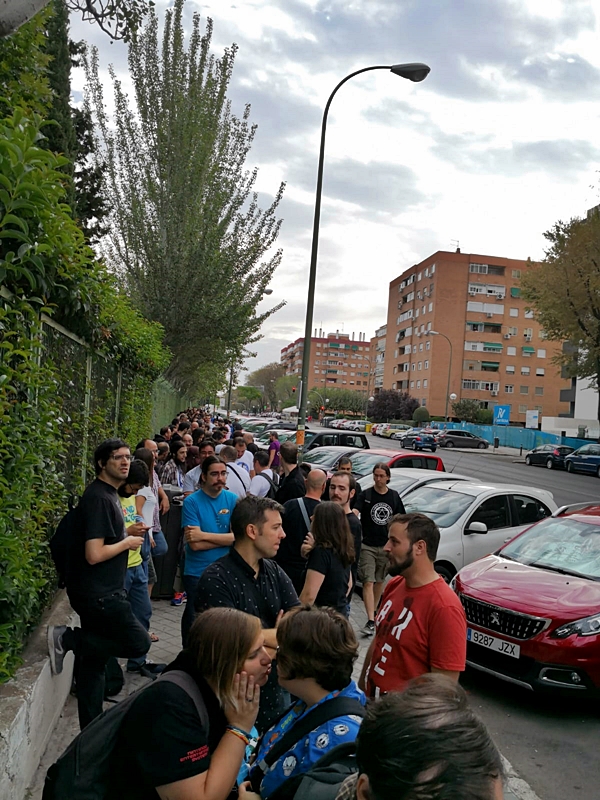
Where is `window`? This screenshot has height=800, width=600. window is located at coordinates (495, 497).